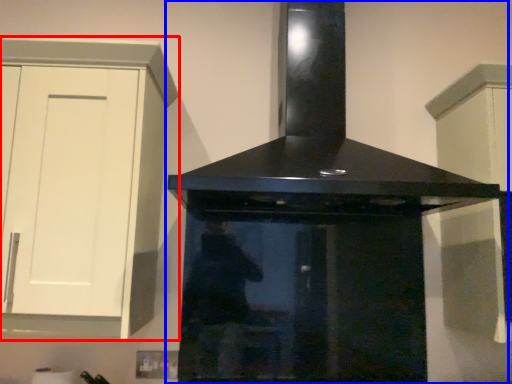
Question: Among these objects, which one is nearest to the camera, cabinetry (highlighted by a red box) or home appliance (highlighted by a blue box)?

Choices:
 (A) cabinetry
 (B) home appliance

Answer: (B)